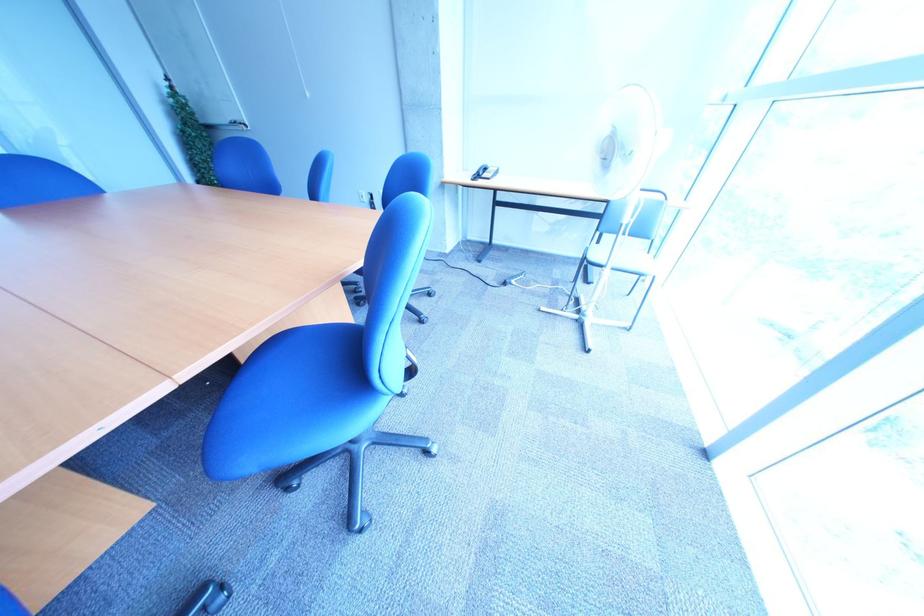
You are a GUI agent. You are given a task and a screenshot of the screen. Output one action in this format:
    pyautogui.click(x=<x>, y=<y>)
    Task: Click on the white standing fan
    The image size is (924, 616).
    Given the screenshot: What is the action you would take?
    pyautogui.click(x=618, y=182)